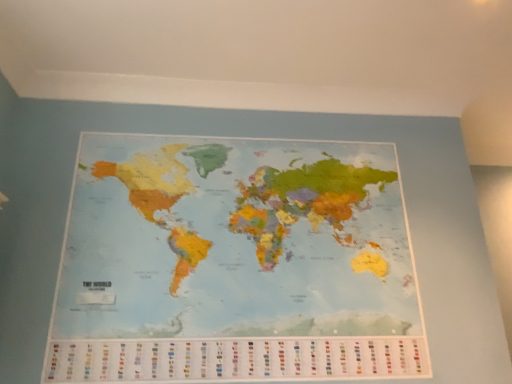
Where is `matte paper map at center`? The height and width of the screenshot is (384, 512). matte paper map at center is located at coordinates (234, 263).

The height and width of the screenshot is (384, 512). Describe the element at coordinates (234, 263) in the screenshot. I see `matte paper map at center` at that location.

I want to click on matte paper map at center, so click(234, 263).